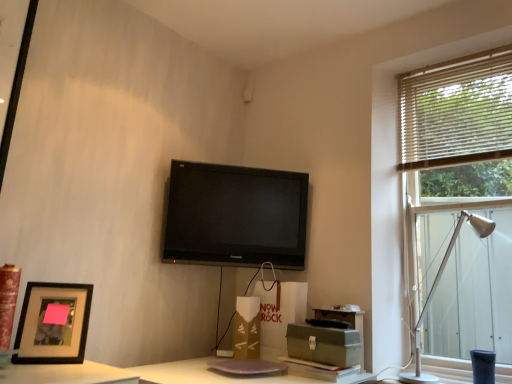
This screenshot has width=512, height=384. Describe the element at coordinates (455, 117) in the screenshot. I see `wooden blinds at right` at that location.

This screenshot has width=512, height=384. What are the coordinates of `white wooden blinds at upper right` in the screenshot? It's located at tap(456, 111).

The width and height of the screenshot is (512, 384). What do you see at coordinates (247, 95) in the screenshot?
I see `matte white speaker at upper center` at bounding box center [247, 95].

Where is `matte black picture frame at lower left`? matte black picture frame at lower left is located at coordinates (53, 323).

At what (x,y) coordinates should I click in order to perform the action: click on wooden blinds at right. Please return your answer as a coordinate pair (x, y). The height and width of the screenshot is (384, 512). Looking at the image, I should click on (455, 117).

Is point (245, 299) more distant than point (463, 84)?

Yes, point (245, 299) is farther from viewer.

The height and width of the screenshot is (384, 512). Identify the location of blind above the matte brown cardboard box at center, positioned as the 2th cardboard box in front-to-back order (from a real-world perspective). (456, 111).

Can you tell me how much matte brown cardboard box at center, the second cardboard box positioned from the right, and white wooden blinds at upper right differ in facing direction?

matte brown cardboard box at center, the second cardboard box positioned from the right, and white wooden blinds at upper right are facing 0.465 degrees away from each other.

Are matte white speaker at upper center and black glossy tv at upper center far apart?

No.

Is matte white speaker at upper center positioned with its back to black glossy tv at upper center?

No, matte white speaker at upper center is not facing away from black glossy tv at upper center.

Would you say matte white speaker at upper center is to the left or to the right of black glossy tv at upper center in the picture?

matte white speaker at upper center is to the right of black glossy tv at upper center.

Who is taller, matte white speaker at upper center or black glossy tv at upper center?

With more height is black glossy tv at upper center.

Where is `window located in front of the matte white speaker at upper center`? This screenshot has width=512, height=384. window located in front of the matte white speaker at upper center is located at coordinates (455, 117).

Would you say wooden blinds at right is inside or outside matte white speaker at upper center?

wooden blinds at right is not enclosed by matte white speaker at upper center.

In the scene shown: Considering the relative sizes of wooden blinds at right and matte white speaker at upper center in the image provided, is wooden blinds at right thinner than matte white speaker at upper center?

Incorrect, the width of wooden blinds at right is not less than that of matte white speaker at upper center.

What's the angular difference between wooden blinds at right and matte white speaker at upper center's facing directions?

They differ by 89 degrees in their facing directions.

From the picture: Visually, is green cardboard box at lower center, which ranks as the 2th cardboard box in back-to-front order, positioned to the left or to the right of wooden blinds at right?

In the image, green cardboard box at lower center, which ranks as the 2th cardboard box in back-to-front order, appears on the left side of wooden blinds at right.

From the image's perspective, is green cardboard box at lower center, the first cardboard box viewed from the right, located above or below wooden blinds at right?

Clearly, from the image's perspective, green cardboard box at lower center, the first cardboard box viewed from the right, is below wooden blinds at right.

From a real-world perspective, is green cardboard box at lower center, the first cardboard box viewed from the right, located higher than wooden blinds at right?

Actually, green cardboard box at lower center, the first cardboard box viewed from the right, is physically below wooden blinds at right in the real world.

Which of these two, green cardboard box at lower center, the first cardboard box viewed from the right, or wooden blinds at right, is bigger?

wooden blinds at right.

Does matte white speaker at upper center lie behind matte black picture frame at lower left?

Yes, it is behind matte black picture frame at lower left.

Consider the image. Considering the relative sizes of matte white speaker at upper center and matte black picture frame at lower left in the image provided, is matte white speaker at upper center thinner than matte black picture frame at lower left?

Correct, the width of matte white speaker at upper center is less than that of matte black picture frame at lower left.

From a real-world perspective, is matte white speaker at upper center positioned above or below matte black picture frame at lower left?

Clearly, from a real-world perspective, matte white speaker at upper center is above matte black picture frame at lower left.

Is point (248, 95) farther from viewer compared to point (42, 353)?

Yes, it is behind point (42, 353).

Does wooden blinds at right have a smaller size compared to green cardboard box at lower center, which ranks as the 2th cardboard box in back-to-front order?

No.

Is wooden blinds at right shorter than green cardboard box at lower center, which ranks as the 2th cardboard box in back-to-front order?

Incorrect, the height of wooden blinds at right does not fall short of that of green cardboard box at lower center, which ranks as the 2th cardboard box in back-to-front order.

Is wooden blinds at right further to the viewer compared to green cardboard box at lower center, which ranks as the 2th cardboard box in back-to-front order?

Yes, the depth of wooden blinds at right is greater than that of green cardboard box at lower center, which ranks as the 2th cardboard box in back-to-front order.

Who is more distant, black glossy tv at upper center or matte brown cardboard box at center, the first cardboard box when ordered from left to right?

black glossy tv at upper center is more distant.

Does black glossy tv at upper center have a smaller size compared to matte brown cardboard box at center, positioned as the 2th cardboard box in front-to-back order?

Actually, black glossy tv at upper center might be larger than matte brown cardboard box at center, positioned as the 2th cardboard box in front-to-back order.

In the scene shown: From a real-world perspective, which object rests below the other?

matte brown cardboard box at center, positioned as the 2th cardboard box in front-to-back order.

Is matte brown cardboard box at center, the 1th cardboard box viewed from the back, inside black glossy tv at upper center?

No.

From the image's perspective, starting from the white wooden blinds at upper right, which cardboard box is the 2nd one below? Please provide its 2D coordinates.

[(247, 328)]

The width and height of the screenshot is (512, 384). In order to click on television below the matte white speaker at upper center (from a real-world perspective) in this screenshot , I will do [234, 216].

Based on their spatial positions, is white wooden blinds at upper right or matte white speaker at upper center further from silver metallic table lamp at right?

The object further to silver metallic table lamp at right is matte white speaker at upper center.

Estimate the real-world distances between objects in this image. Which object is closer to wooden blinds at right, matte blue glass vase at lower right or matte black picture frame at lower left?

matte blue glass vase at lower right is positioned closer to the anchor wooden blinds at right.

Considering their positions, is white wooden blinds at upper right positioned further to green cardboard box at lower center, the first cardboard box viewed from the right, than matte brown cardboard box at center, the first cardboard box when ordered from left to right?

Among the two, white wooden blinds at upper right is located further to green cardboard box at lower center, the first cardboard box viewed from the right.

Considering their positions, is black glossy tv at upper center positioned closer to white wooden blinds at upper right than silver metallic table lamp at right?

Among the two, silver metallic table lamp at right is located nearer to white wooden blinds at upper right.

Which object lies nearer to the anchor point silver metallic table lamp at right, matte black picture frame at lower left or matte white speaker at upper center?

matte black picture frame at lower left.

Considering their positions, is wooden blinds at right positioned closer to matte black picture frame at lower left than green cardboard box at lower center, acting as the 2th cardboard box starting from the left?

The object closer to matte black picture frame at lower left is green cardboard box at lower center, acting as the 2th cardboard box starting from the left.

Based on their spatial positions, is silver metallic table lamp at right or black glossy tv at upper center closer to green cardboard box at lower center, the first cardboard box viewed from the right?

silver metallic table lamp at right is positioned closer to the anchor green cardboard box at lower center, the first cardboard box viewed from the right.

From the picture: From the image, which object appears to be nearer to matte white speaker at upper center, green cardboard box at lower center, the first cardboard box viewed from the right, or white wooden blinds at upper right?

white wooden blinds at upper right.

Where is `television between matte white speaker at upper center and matte brown cardboard box at center, the 1th cardboard box viewed from the back, in the up-down direction`? television between matte white speaker at upper center and matte brown cardboard box at center, the 1th cardboard box viewed from the back, in the up-down direction is located at coordinates (234, 216).

Identify the location of table lamp between matte brown cardboard box at center, the first cardboard box when ordered from left to right, and matte blue glass vase at lower right. The image size is (512, 384). (436, 289).

Locate an element on the screen. table lamp that lies between matte white speaker at upper center and matte blue glass vase at lower right from top to bottom is located at coordinates (436, 289).

The height and width of the screenshot is (384, 512). I want to click on window between black glossy tv at upper center and white wooden blinds at upper right, so click(455, 117).